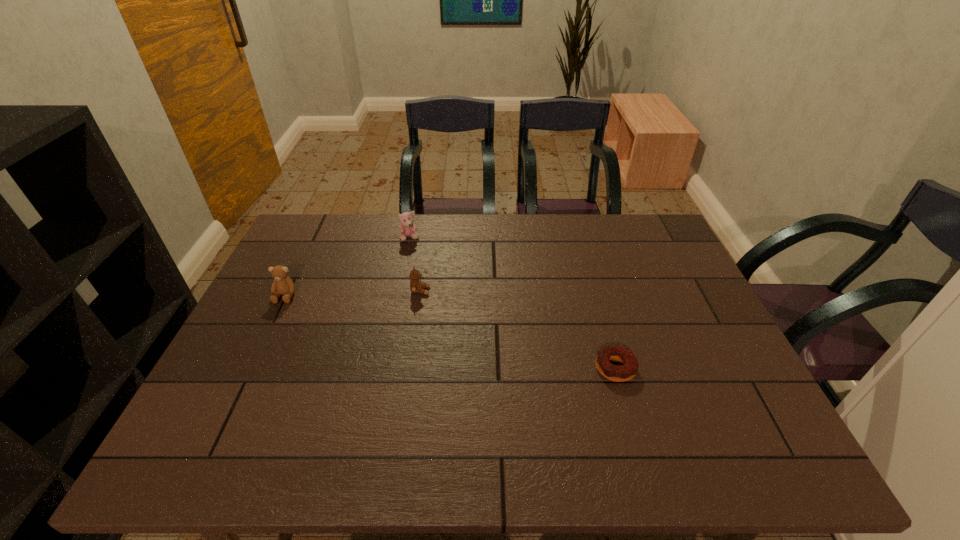
Identify the location of the third object from right to left. (407, 228).

At what (x,y) coordinates should I click in order to perform the action: click on the farthest object. Please return your answer as a coordinate pair (x, y). This screenshot has width=960, height=540. Looking at the image, I should click on coord(407,228).

Identify the location of the leftmost object. The width and height of the screenshot is (960, 540). (282, 285).

Identify the location of the rightmost teddy bear. (416, 286).

I want to click on the second shortest object, so click(416, 286).

You are a GUI agent. You are given a task and a screenshot of the screen. Output one action in this format:
    pyautogui.click(x=<x>, y=<y>)
    Task: Click on the doughnut
    
    Given the screenshot: What is the action you would take?
    pyautogui.click(x=627, y=371)

Where is `the nearest object`? the nearest object is located at coordinates (627, 371).

The height and width of the screenshot is (540, 960). In order to click on free space located at the face of the farthest teddy bear in this screenshot , I will do `click(407, 254)`.

Where is `free spot located on the front-facing side of the leftmost teddy bear`? free spot located on the front-facing side of the leftmost teddy bear is located at coordinates (273, 322).

I want to click on blank area located on the front-facing side of the third object from left to right, so click(x=457, y=291).